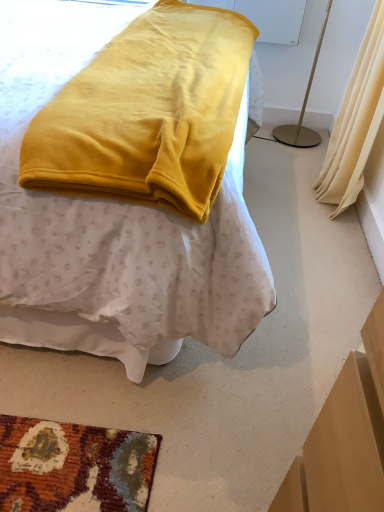
This screenshot has width=384, height=512. Describe the element at coordinates (111, 226) in the screenshot. I see `velvet yellow blanket at center` at that location.

This screenshot has width=384, height=512. I want to click on velvet yellow blanket at center, so click(x=111, y=226).

From the image's perspective, between white plastic lampshade at upper right and velvet yellow blanket at center, who is located below?

velvet yellow blanket at center, from the image's perspective.

Is white plastic lampshade at upper right facing towards velvet yellow blanket at center?

No, white plastic lampshade at upper right is not facing towards velvet yellow blanket at center.

What's the angular difference between white plastic lampshade at upper right and velvet yellow blanket at center's facing directions?

The facing directions of white plastic lampshade at upper right and velvet yellow blanket at center are 90 degrees apart.

What are the coordinates of `bedside lamp lying behind the velvet yellow blanket at center` in the screenshot? It's located at (303, 108).

Between velvet yellow blanket at center and white plastic lampshade at upper right, which one has smaller width?

Thinner between the two is white plastic lampshade at upper right.

Which object is more forward, velvet yellow blanket at center or white plastic lampshade at upper right?

velvet yellow blanket at center is in front.

Which of these two, velvet yellow blanket at center or white plastic lampshade at upper right, is smaller?

white plastic lampshade at upper right is smaller.

Can you confirm if beige fabric curtain at right is positioned to the left of velvet yellow blanket at center?

No, beige fabric curtain at right is not to the left of velvet yellow blanket at center.

From a real-world perspective, is beige fabric curtain at right located beneath velvet yellow blanket at center?

Correct, in the physical world, beige fabric curtain at right is lower than velvet yellow blanket at center.

From the image's perspective, is beige fabric curtain at right under velvet yellow blanket at center?

Incorrect, from the image's perspective, beige fabric curtain at right is higher than velvet yellow blanket at center.

Is white plastic lampshade at upper right touching beige fabric curtain at right?

No, white plastic lampshade at upper right is not beside beige fabric curtain at right.

Which is farther, (303, 132) or (373, 15)?

The point (303, 132) is farther from the camera.

I want to click on bedside lamp above the beige fabric curtain at right (from a real-world perspective), so click(x=303, y=108).

In order to click on curtain below the white plastic lampshade at upper right (from the image's perspective) in this screenshot , I will do `click(355, 121)`.

Looking at the image, does beige fabric curtain at right seem bigger or smaller compared to white plastic lampshade at upper right?

beige fabric curtain at right is bigger than white plastic lampshade at upper right.

Who is more distant, beige fabric curtain at right or white plastic lampshade at upper right?

white plastic lampshade at upper right is further away from the camera.

Which point is more distant from viewer, (327, 183) or (327, 7)?

The point (327, 7) is farther from the camera.

From the image's perspective, which one is positioned lower, velvet yellow blanket at center or beige fabric curtain at right?

velvet yellow blanket at center appears lower in the image.

Is there a large distance between velvet yellow blanket at center and beige fabric curtain at right?

velvet yellow blanket at center is positioned a significant distance from beige fabric curtain at right.

Is velvet yellow blanket at center oriented towards beige fabric curtain at right?

Yes, velvet yellow blanket at center is oriented towards beige fabric curtain at right.

I want to click on bedside lamp on the right side of velvet yellow blanket at center, so click(x=303, y=108).

The width and height of the screenshot is (384, 512). I want to click on bedside lamp directly beneath the velvet yellow blanket at center (from a real-world perspective), so click(303, 108).

Looking at the image, which one is located further to white plastic lampshade at upper right, beige fabric curtain at right or velvet yellow blanket at center?

The object further to white plastic lampshade at upper right is velvet yellow blanket at center.

From the image, which object appears to be farther from velvet yellow blanket at center, beige fabric curtain at right or white plastic lampshade at upper right?

white plastic lampshade at upper right lies further to velvet yellow blanket at center than the other object.

Based on their spatial positions, is velvet yellow blanket at center or beige fabric curtain at right further from white plastic lampshade at upper right?

velvet yellow blanket at center lies further to white plastic lampshade at upper right than the other object.

Which object lies further to the anchor point beige fabric curtain at right, white plastic lampshade at upper right or velvet yellow blanket at center?

Among the two, velvet yellow blanket at center is located further to beige fabric curtain at right.

Based on their spatial positions, is velvet yellow blanket at center or white plastic lampshade at upper right further from beige fabric curtain at right?

velvet yellow blanket at center.

When comparing their distances from velvet yellow blanket at center, does white plastic lampshade at upper right or beige fabric curtain at right seem closer?

beige fabric curtain at right is closer to velvet yellow blanket at center.

This screenshot has width=384, height=512. I want to click on curtain between velvet yellow blanket at center and white plastic lampshade at upper right from front to back, so click(x=355, y=121).